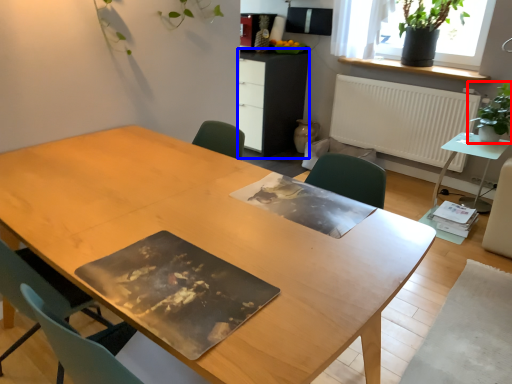
Question: Which of the following is the farthest to the observer, houseplant (highlighted by a red box) or computer desk (highlighted by a blue box)?

Choices:
 (A) houseplant
 (B) computer desk

Answer: (B)